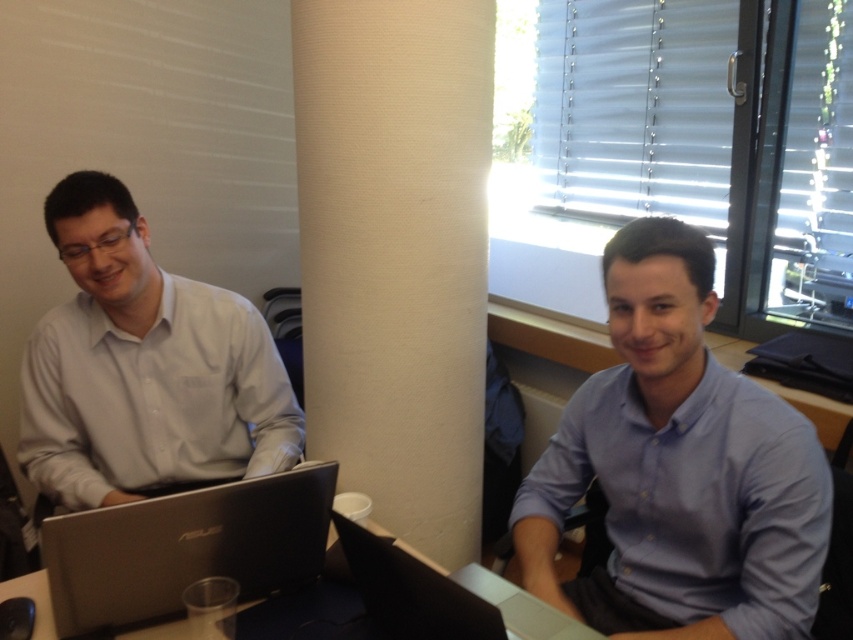
Question: Which is nearer to the silver metallic laptop at center?

Choices:
 (A) beige textured pillar at center
 (B) blue smooth shirt at center
 (C) silver metallic laptop at lower left

Answer: (C)

Question: Does beige textured pillar at center appear on the right side of silver metallic laptop at lower left?

Choices:
 (A) no
 (B) yes

Answer: (B)

Question: Estimate the real-world distances between objects in this image. Which object is farther from the silver metallic laptop at lower left?

Choices:
 (A) blue smooth shirt at center
 (B) beige textured pillar at center
 (C) silver metallic table at lower center
 (D) silver metallic laptop at center

Answer: (B)

Question: Which object is farther from the camera taking this photo?

Choices:
 (A) matte white shirt at left
 (B) silver metallic laptop at center
 (C) silver metallic laptop at lower left
 (D) beige textured pillar at center

Answer: (D)

Question: Can you confirm if beige textured pillar at center is thinner than silver metallic laptop at lower left?

Choices:
 (A) yes
 (B) no

Answer: (B)

Question: Can you confirm if beige textured pillar at center is positioned below silver metallic table at lower center?

Choices:
 (A) no
 (B) yes

Answer: (A)